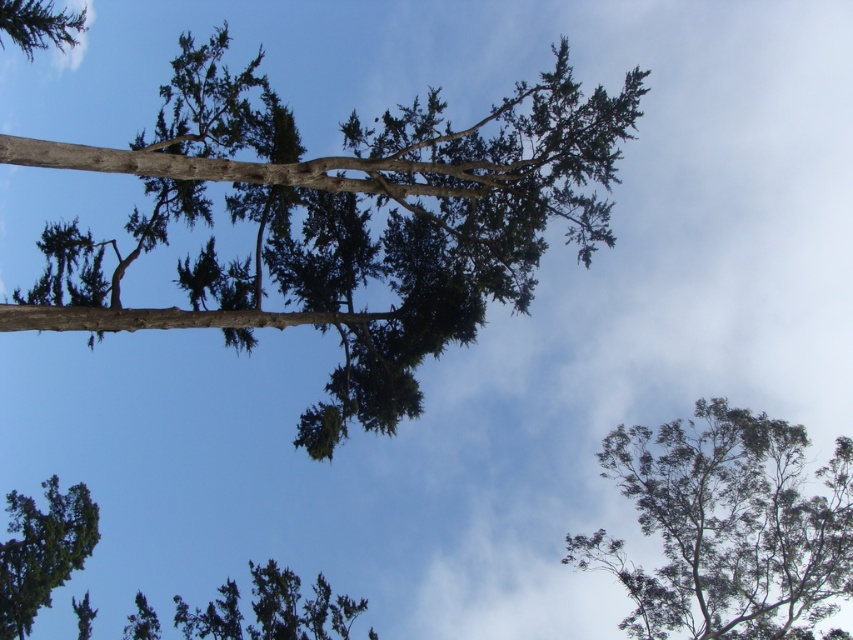
Question: Is green leafy tree at upper right thinner than green needle-like at lower left?

Choices:
 (A) yes
 (B) no

Answer: (B)

Question: Considering the real-world distances, which object is closest to the green textured tree at lower center?

Choices:
 (A) green needle-like at upper left
 (B) green textured tree at center
 (C) green needle-like at lower left
 (D) green leafy tree at upper right

Answer: (C)

Question: Is green leafy tree at upper right bigger than green needle-like at lower left?

Choices:
 (A) no
 (B) yes

Answer: (B)

Question: Does green leafy tree at upper right appear over green textured tree at lower center?

Choices:
 (A) yes
 (B) no

Answer: (A)

Question: Among these points, which one is farthest from the camera?

Choices:
 (A) (581, 116)
 (B) (671, 499)

Answer: (B)

Question: Among these objects, which one is nearest to the camera?

Choices:
 (A) green textured tree at lower center
 (B) green needle-like at upper left
 (C) green textured tree at center
 (D) green needle-like at lower left

Answer: (C)